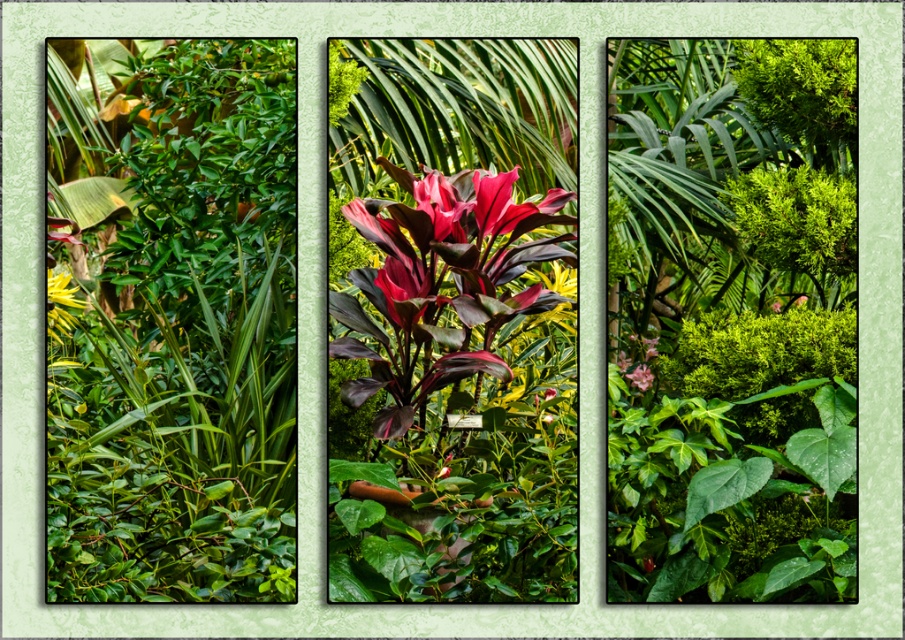
In the left panel of the triptych, you see a shiny crimson petals at center and a pink matte flower at center. Which one is located to the left?

The shiny crimson petals at center is positioned on the left side of the pink matte flower at center, so it is more to the left.

You are a gardener who wants to plant a new flower between the green leafy bush at center and the shiny crimson petals at center. The flower requires at least 1 meter of space to grow. Do you think there is enough space between them?

The green leafy bush at center and the shiny crimson petals at center are 1.06 meters apart from each other. Since the required space is 1 meter, there is enough space to plant the flower between them.

You are an artist planning to paint a tropical garden scene. You notice the shiny crimson petals at center and the pink matte flower at center in the left panel. Which of these two flowers should you depict as the focal point if you want to emphasize size differences?

The shiny crimson petals at center is larger in size than the pink matte flower at center, so it should be depicted as the focal point to emphasize size differences.